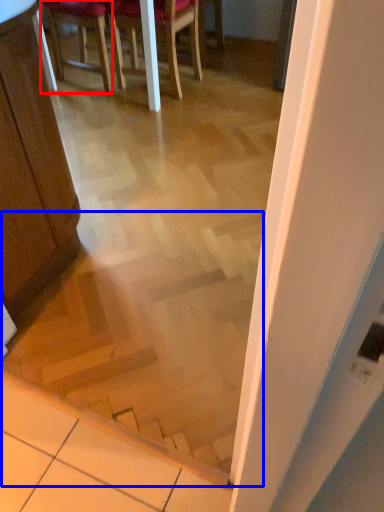
Question: Which object is further to the camera taking this photo, chair (highlighted by a red box) or stairwell (highlighted by a blue box)?

Choices:
 (A) chair
 (B) stairwell

Answer: (A)